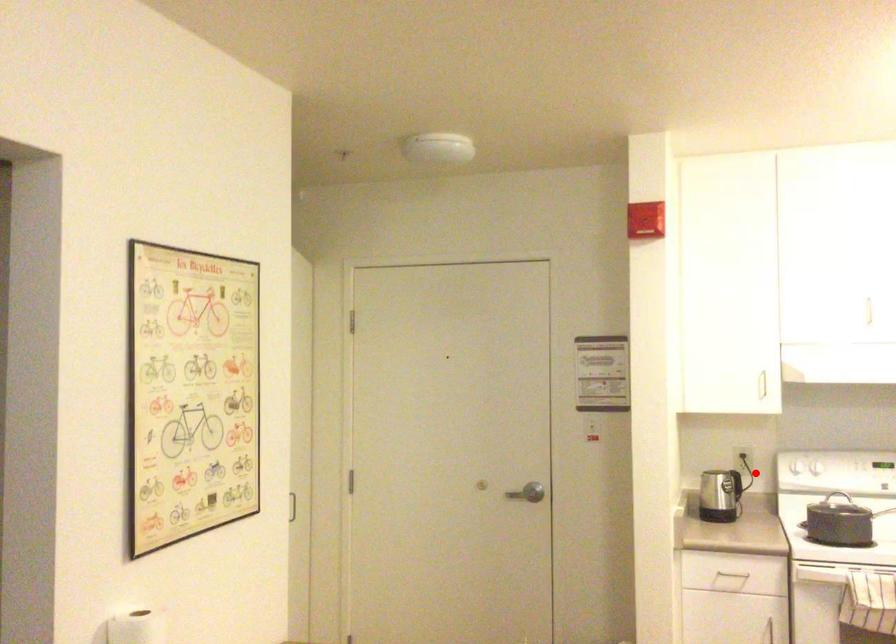
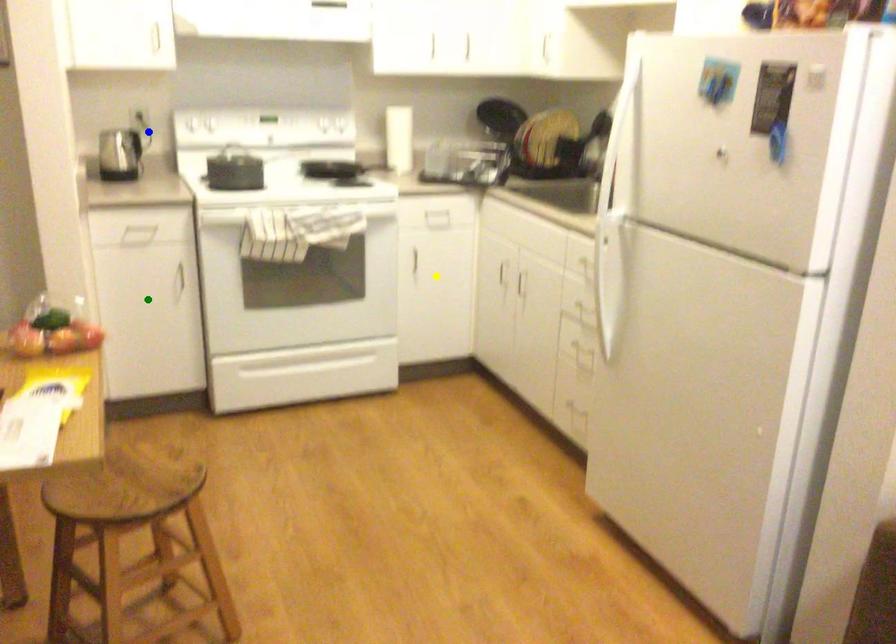
Question: I am providing you with two images of the same scene from different viewpoints. A red point is marked on the first image. You are given multiple points on the second image. Which point in image 2 represents the same 3d spot as the red point in image 1?

Choices:
 (A) yellow point
 (B) blue point
 (C) green point

Answer: (B)